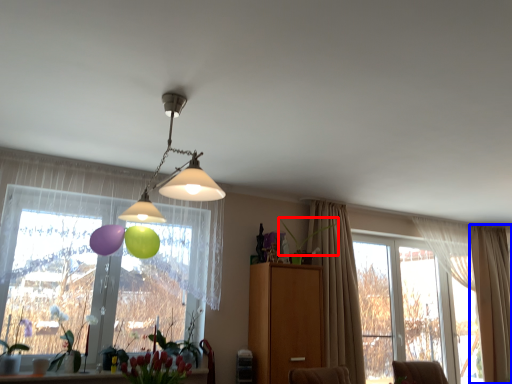
Question: Which point is further to the camera, plant (highlighted by a red box) or curtain (highlighted by a blue box)?

Choices:
 (A) plant
 (B) curtain

Answer: (B)